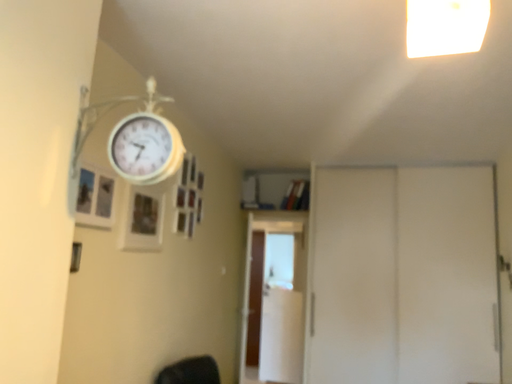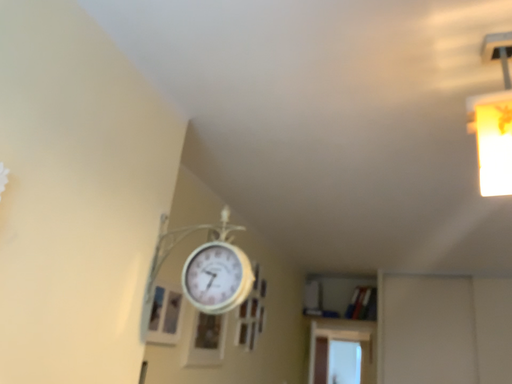
Question: Which way did the camera rotate in the video?

Choices:
 (A) rotated upward
 (B) rotated downward

Answer: (A)